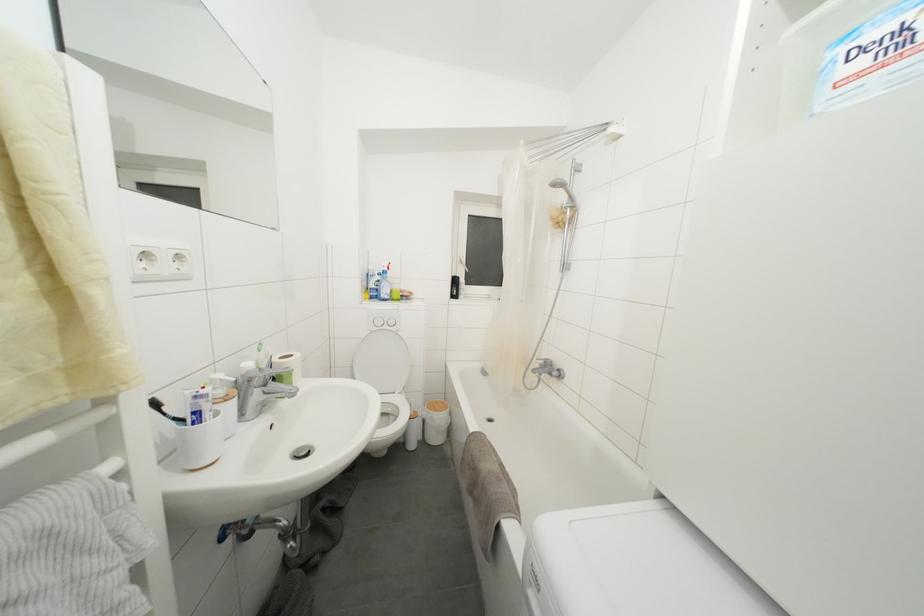
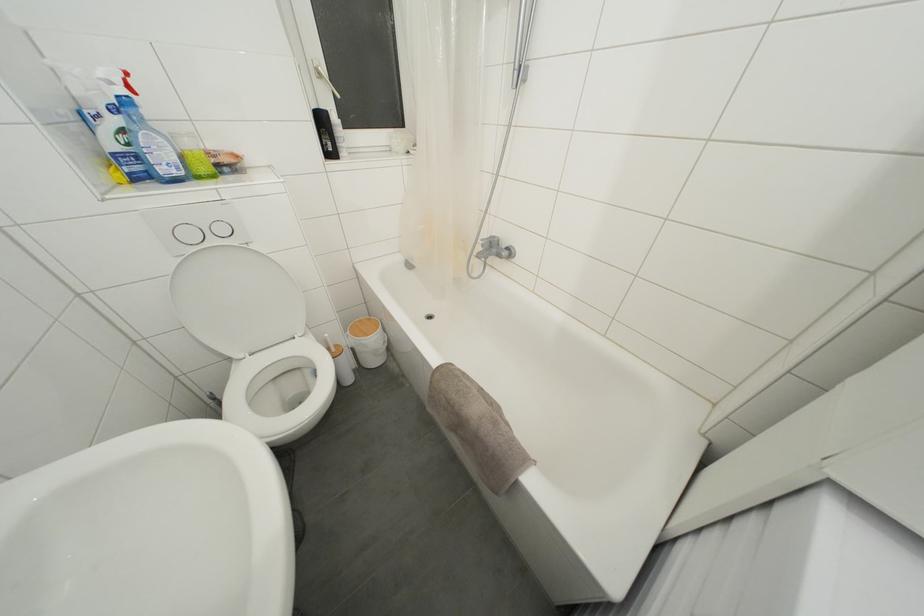
Where in the second image is the point corresponding to (x=458, y=286) from the first image?

(325, 126)